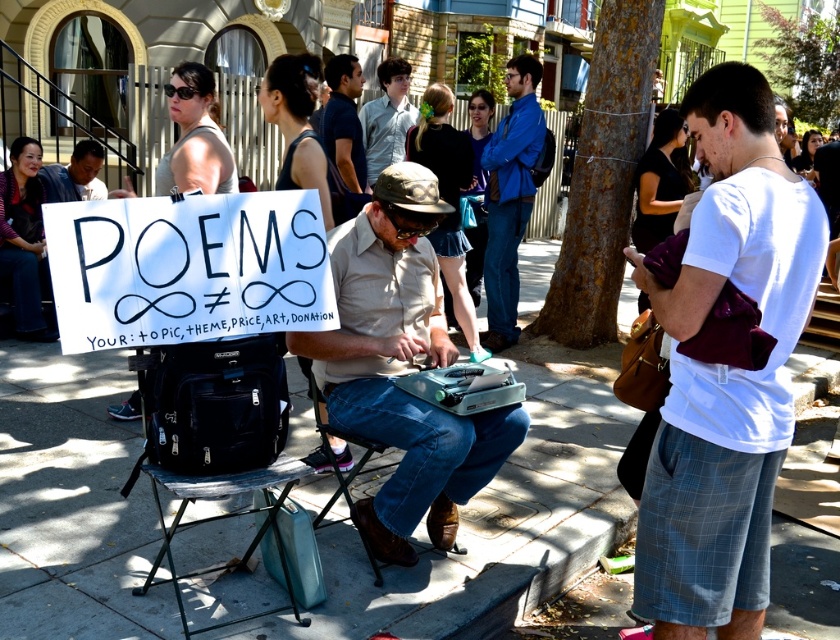
You are standing in the city street scene and need to locate the khaki cotton shirt at center. According to the coordinates provided, where exactly is it positioned?

The khaki cotton shirt at center is located at point (402, 368).